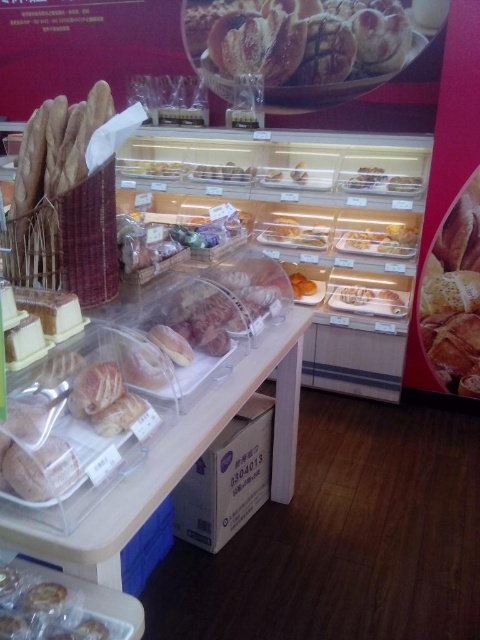
You are a customer at the bakery and want to choose between the matte brown bread at right and the translucent plastic pastries at lower left. Which one is bigger in size?

The matte brown bread at right has a larger size compared to the translucent plastic pastries at lower left, so the matte brown bread at right is bigger in size.

You are standing in the bakery and want to reach the point at coordinates point (340, 26). If your maximum reach is 8 feet, can you reach that point?

The point (340, 26) is 8.52 feet away from the camera, which is beyond your maximum reach of 8 feet. You cannot reach it.